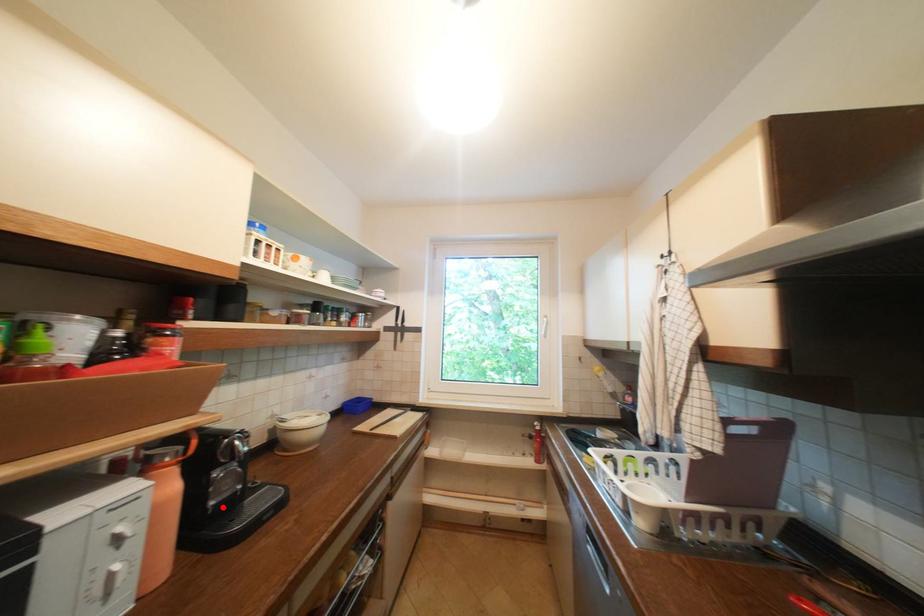
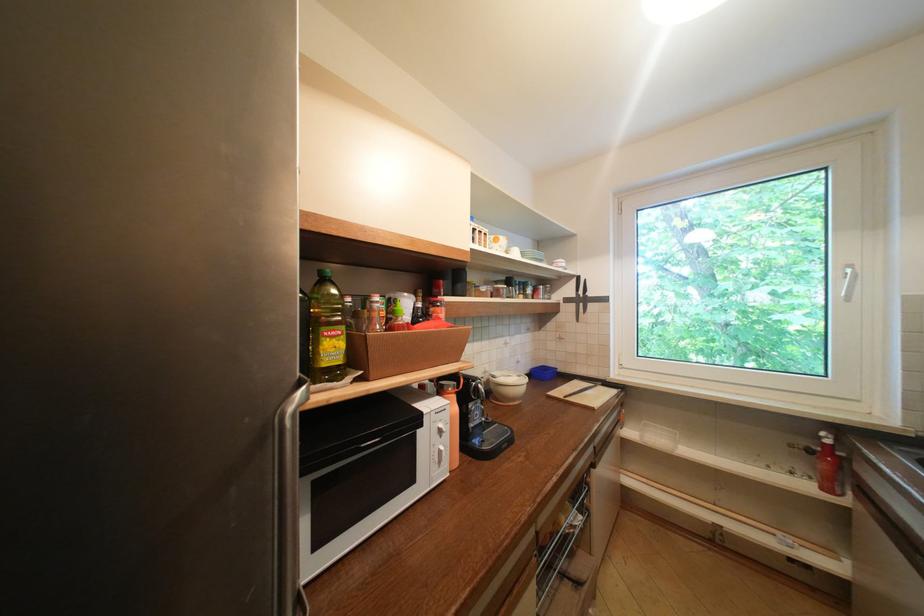
Question: I am providing you with two images of the same scene from different viewpoints. Image1 has a red point marked. In image2, the corresponding 3D location appears at what relative position? Reply with the corresponding letter.

Choices:
 (A) Closer
 (B) Farther

Answer: (B)